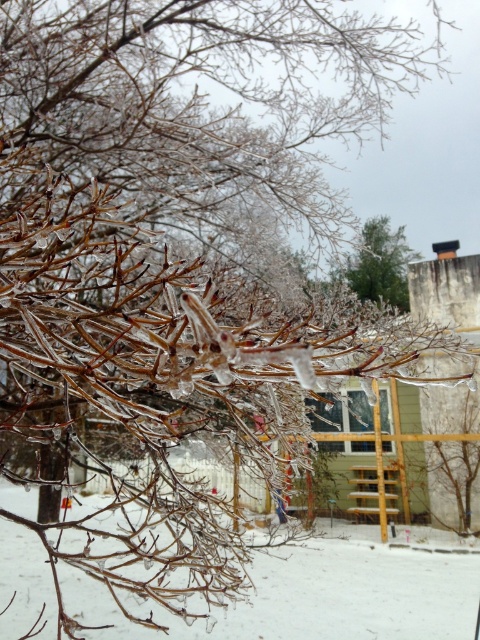
You are standing at the center of the winter scene and want to move towards the white frosty snow at lower left. Which direction should you face to walk directly towards it?

The white frosty snow at lower left is located at point [317,595], so you should face towards the lower left direction to walk directly towards it.

In the scene shown: You are standing in the winter scene and want to take a photo of the green matte tree at upper center without the white frosty snow at lower left appearing in the frame. How should you position yourself to achieve this?

To avoid including the white frosty snow at lower left in the photo, position yourself so that the green matte tree at upper center is framed above the snow. Since the snow is below the tree, angling the camera upward or moving closer to the tree will help exclude the snow from the shot.